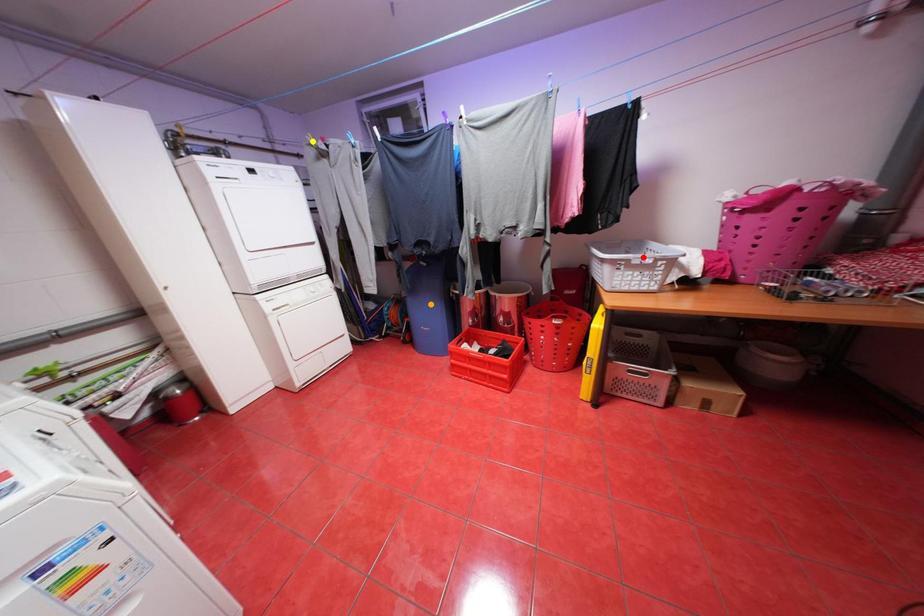
Consider the image. Order these from nearest to farthest:
1. red point
2. yellow point
3. orange point

orange point
yellow point
red point